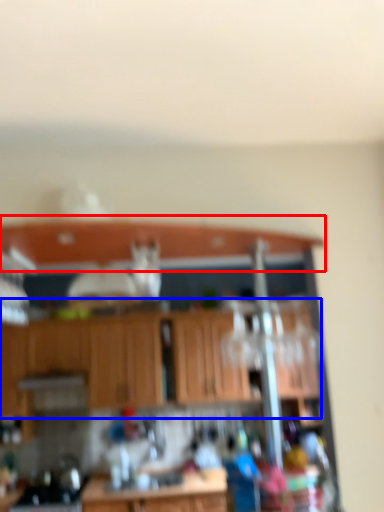
Question: Which of the following is the farthest to the observer, window sill (highlighted by a red box) or cabinetry (highlighted by a blue box)?

Choices:
 (A) window sill
 (B) cabinetry

Answer: (B)